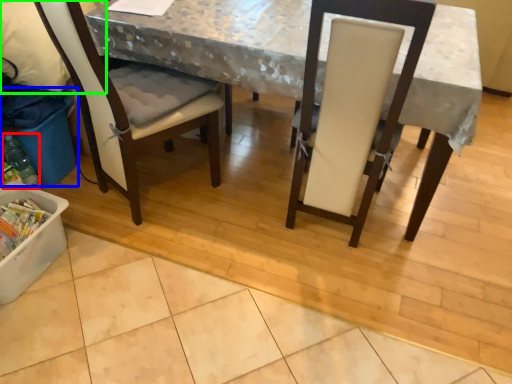
Question: Which is nearer to the bottle (highlighted by a red box)? recycling bin (highlighted by a blue box) or leftover (highlighted by a green box).

Choices:
 (A) recycling bin
 (B) leftover

Answer: (A)